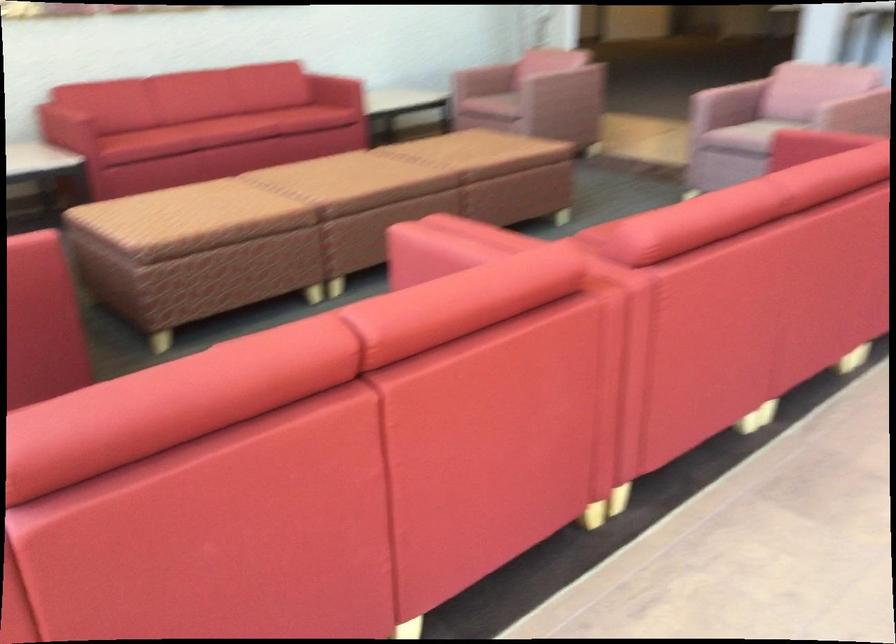
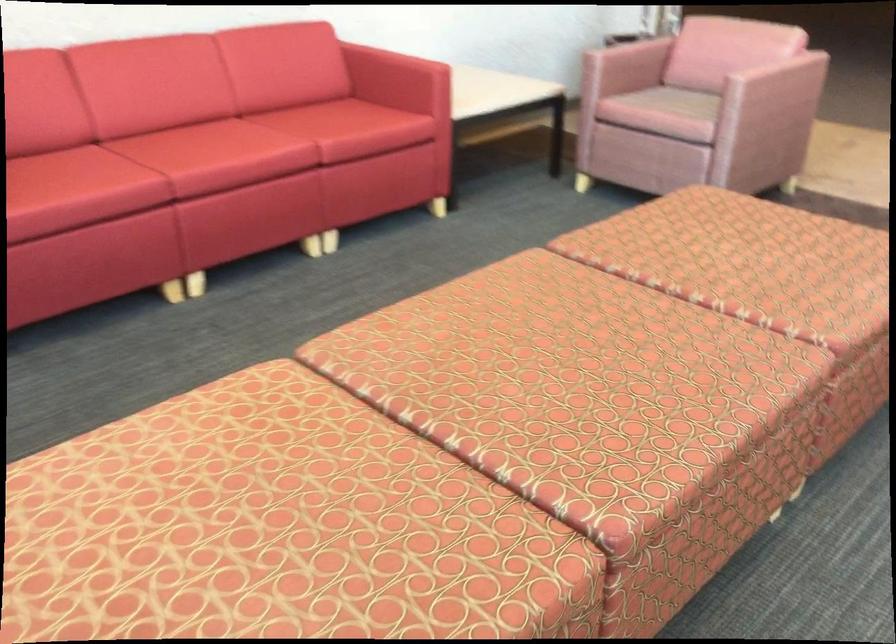
Find the pixel in the second image that matches (x=340, y=174) in the first image.

(549, 377)